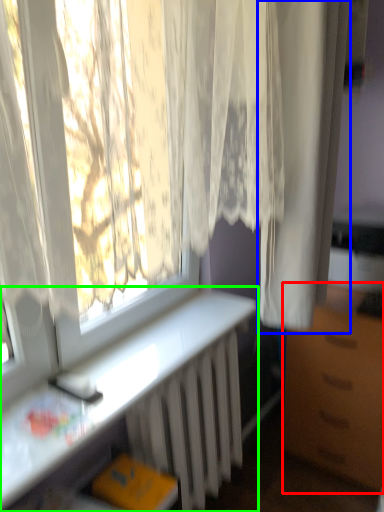
Question: Which is nearer to the furniture (highlighted by a red box)? curtain (highlighted by a blue box) or desk (highlighted by a green box).

Choices:
 (A) curtain
 (B) desk

Answer: (B)